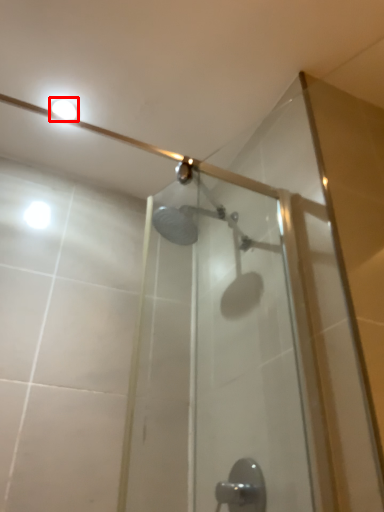
Question: From the image's perspective, what is the correct spatial relationship of light fixture (annotated by the red box) in relation to door handle?

Choices:
 (A) below
 (B) above

Answer: (B)